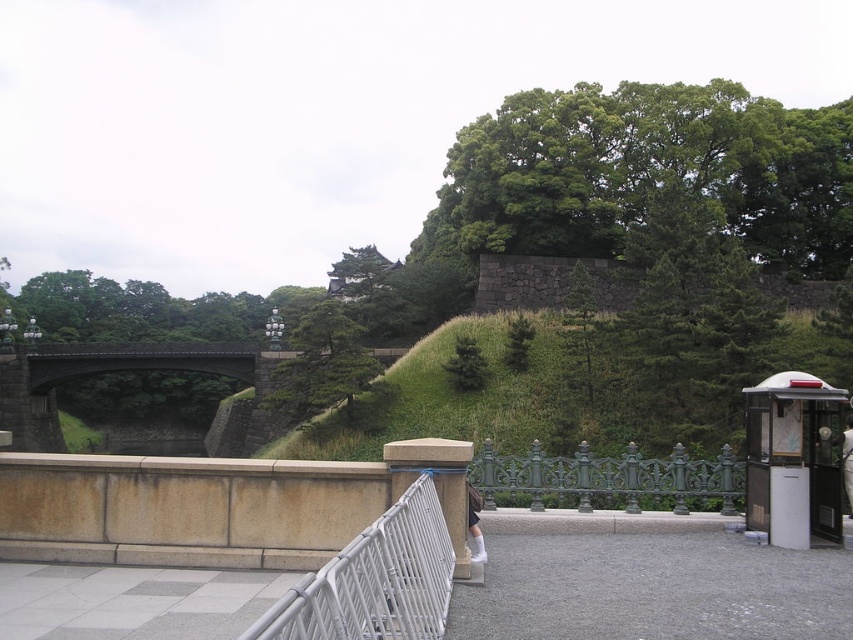
Based on the photo, does white metal fence at center lie in front of dark gray stone bridge at center?

Yes, white metal fence at center is in front of dark gray stone bridge at center.

Can you confirm if white metal fence at center is bigger than dark gray stone bridge at center?

No, white metal fence at center is not bigger than dark gray stone bridge at center.

Which is in front, point (434, 566) or point (160, 360)?

Point (434, 566) is more forward.

Locate an element on the screen. This screenshot has height=640, width=853. white metal fence at center is located at coordinates (375, 580).

Which is more to the left, dark gray stone bridge at center or green cast iron fence at center?

Positioned to the left is dark gray stone bridge at center.

Can you confirm if dark gray stone bridge at center is shorter than green cast iron fence at center?

In fact, dark gray stone bridge at center may be taller than green cast iron fence at center.

What are the coordinates of `dark gray stone bridge at center` in the screenshot? It's located at coord(107,372).

Find the location of a particular element. The image size is (853, 640). dark gray stone bridge at center is located at coordinates [x=107, y=372].

From the picture: Can you confirm if white metal fence at center is bigger than green cast iron fence at center?

No.

Who is more distant from viewer, (363, 552) or (729, 448)?

Point (729, 448)

Where is `white metal fence at center`? The width and height of the screenshot is (853, 640). white metal fence at center is located at coordinates [375, 580].